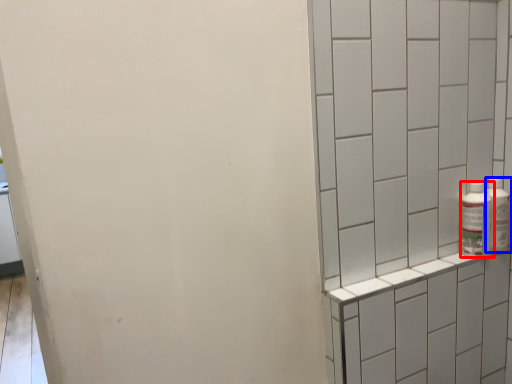
Question: Which object is closer to the camera taking this photo, bottle (highlighted by a red box) or bottle (highlighted by a blue box)?

Choices:
 (A) bottle
 (B) bottle

Answer: (A)